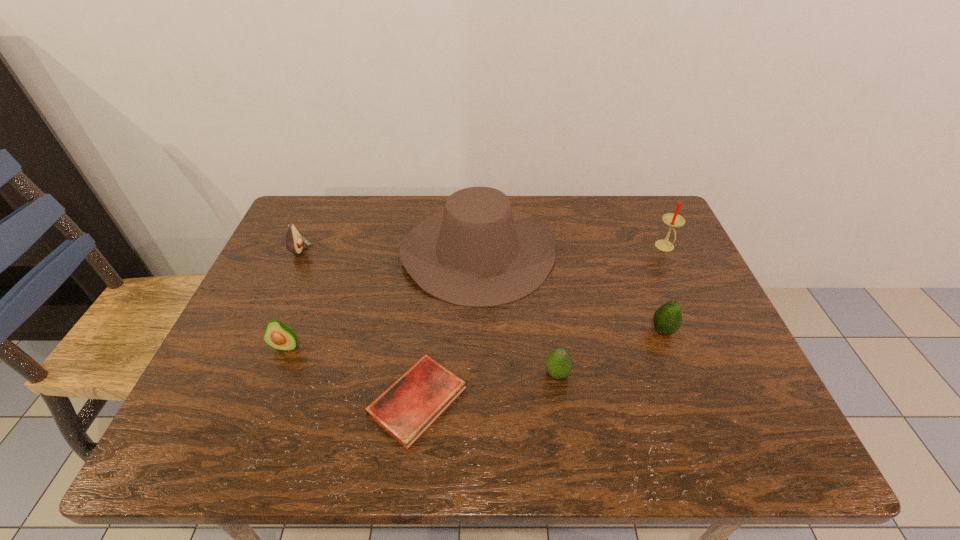
Identify the location of avocado located at the right edge. The height and width of the screenshot is (540, 960). (667, 319).

You are a GUI agent. You are given a task and a screenshot of the screen. Output one action in this format:
    pyautogui.click(x=<x>, y=<y>)
    Task: Click on the object located in the far left corner section of the desktop
    
    Given the screenshot: What is the action you would take?
    pyautogui.click(x=294, y=241)

Identify the location of object present at the far right corner. The image size is (960, 540). (673, 220).

This screenshot has height=540, width=960. In the image, there is a desktop. Identify the location of vacant region at the far edge. (583, 204).

The width and height of the screenshot is (960, 540). Find the location of `vacant space at the right edge of the desktop`. vacant space at the right edge of the desktop is located at coordinates (747, 396).

In the image, there is a desktop. Where is `vacant space at the far left corner`? This screenshot has width=960, height=540. vacant space at the far left corner is located at coordinates (331, 220).

In the image, there is a desktop. Identify the location of free region at the far right corner. [x=665, y=212].

Locate an element on the screen. vacant space at the near right corner of the desktop is located at coordinates (695, 418).

You are a GUI agent. You are given a task and a screenshot of the screen. Output one action in this format:
    pyautogui.click(x=<x>, y=<y>)
    Task: Click on the free space between the diary and the third avocado from right to left
    This screenshot has width=960, height=540.
    Given the screenshot: What is the action you would take?
    pyautogui.click(x=351, y=373)

At what (x,y) coordinates should I click in order to perform the action: click on vacant space that is in between the diary and the second avocado from right to left. Please return your answer as a coordinate pair (x, y). Looking at the image, I should click on (488, 387).